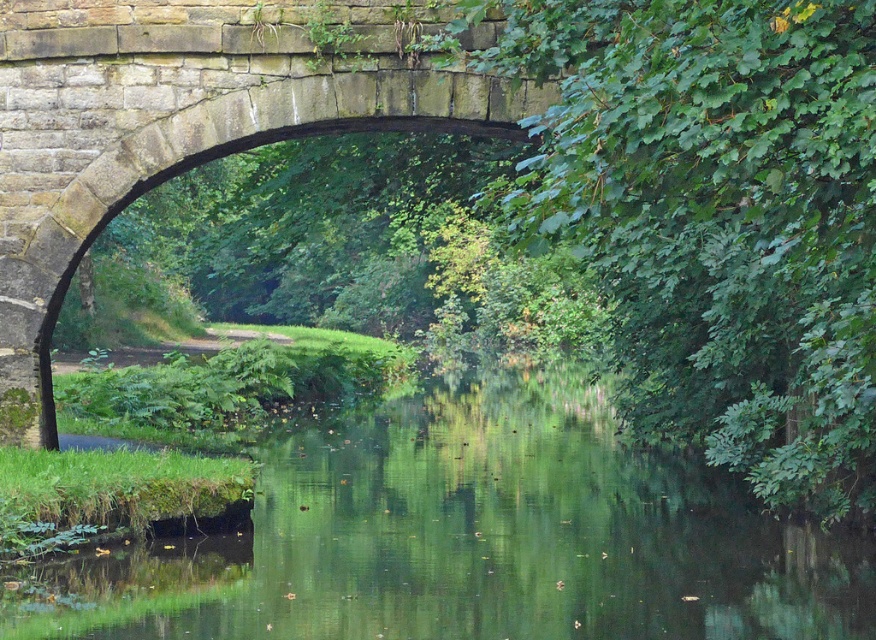
Does green smooth water at center have a smaller size compared to stone bridge at center?

No, green smooth water at center is not smaller than stone bridge at center.

Is green smooth water at center below stone bridge at center?

Correct, green smooth water at center is located below stone bridge at center.

Is point (521, 504) farther from viewer compared to point (22, 250)?

Yes, point (521, 504) is behind point (22, 250).

The height and width of the screenshot is (640, 876). In order to click on green smooth water at center in this screenshot , I will do `click(470, 538)`.